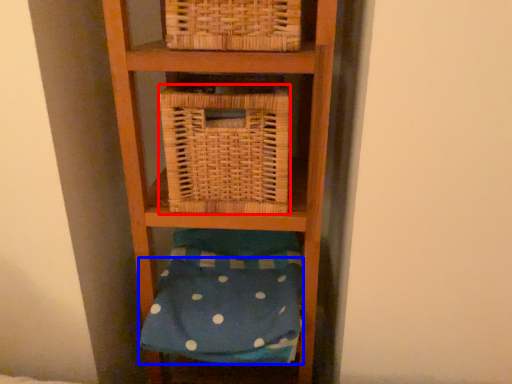
Question: Among these objects, which one is farthest to the camera, basket (highlighted by a red box) or pillow (highlighted by a blue box)?

Choices:
 (A) basket
 (B) pillow

Answer: (B)